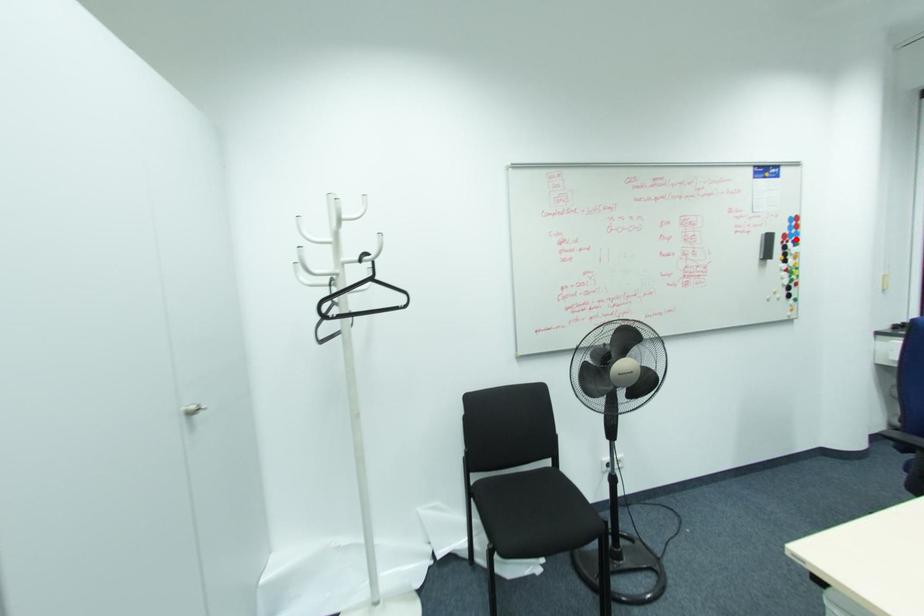
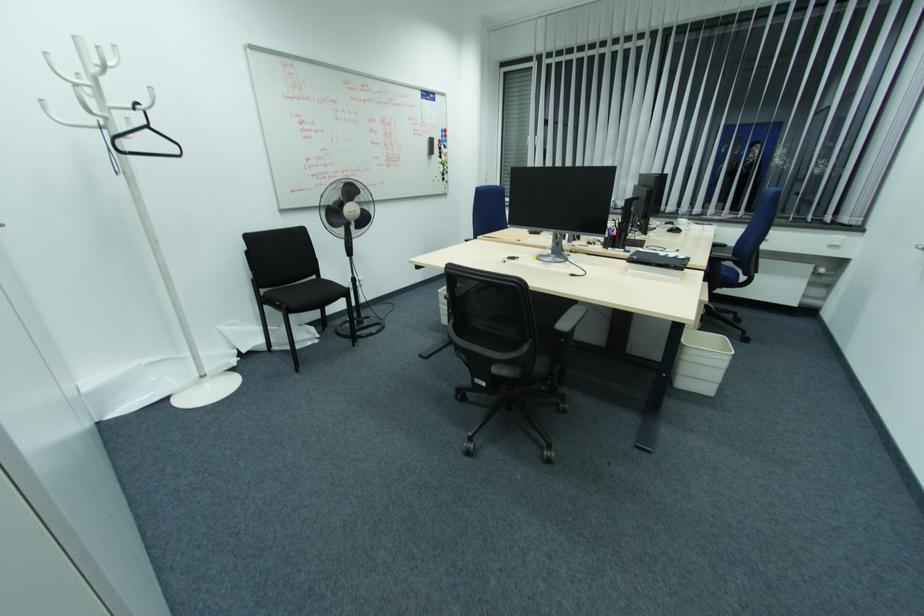
Find the pixel in the second image that matches the highlighted location in the first image.

(445, 144)